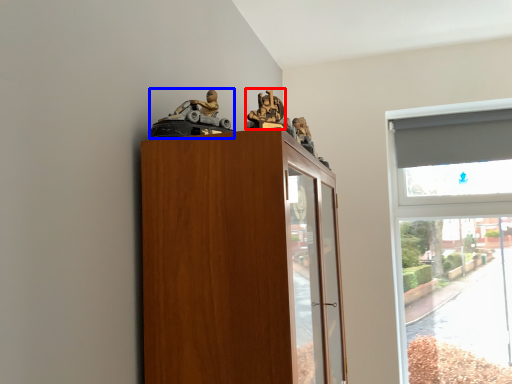
Question: Which object is closer to the camera taking this photo, toy (highlighted by a red box) or toy (highlighted by a blue box)?

Choices:
 (A) toy
 (B) toy

Answer: (B)